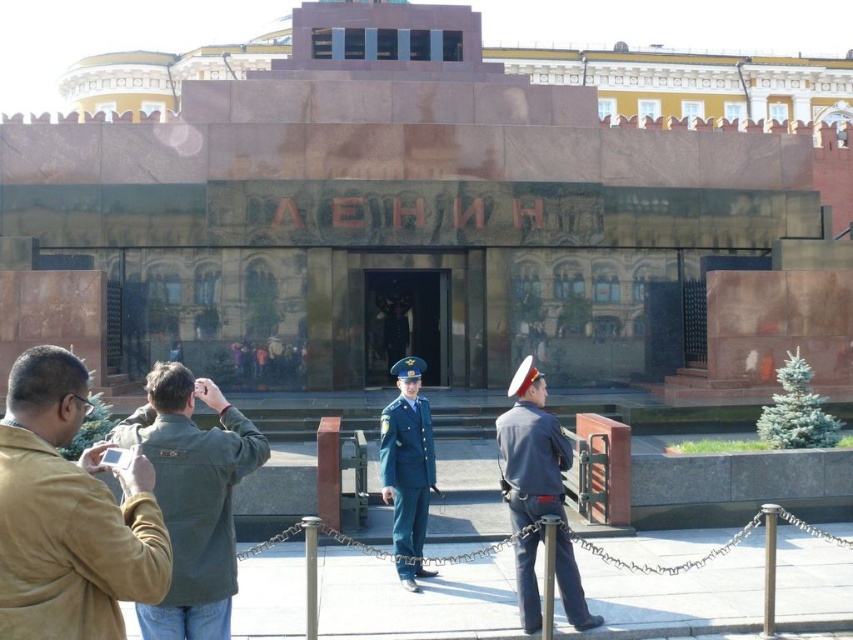
Question: Is dark green jacket at center in front of green fabric uniform at center?

Choices:
 (A) no
 (B) yes

Answer: (B)

Question: Is tan suede jacket at lower left wider than dark green jacket at center?

Choices:
 (A) no
 (B) yes

Answer: (A)

Question: From the image, what is the correct spatial relationship of tan suede jacket at lower left in relation to green fabric uniform at center?

Choices:
 (A) right
 (B) left

Answer: (B)

Question: Which object appears farthest from the camera in this image?

Choices:
 (A) brown polished stone monument at center
 (B) green fabric uniform at center
 (C) tan suede jacket at lower left
 (D) dark blue uniform at center

Answer: (A)

Question: Among these objects, which one is nearest to the camera?

Choices:
 (A) dark blue uniform at center
 (B) dark green jacket at center
 (C) brown polished stone monument at center
 (D) green fabric uniform at center

Answer: (B)

Question: Which of these objects is positioned closest to the dark green jacket at center?

Choices:
 (A) dark blue uniform at center
 (B) tan suede jacket at lower left
 (C) brown polished stone monument at center
 (D) green fabric uniform at center

Answer: (B)